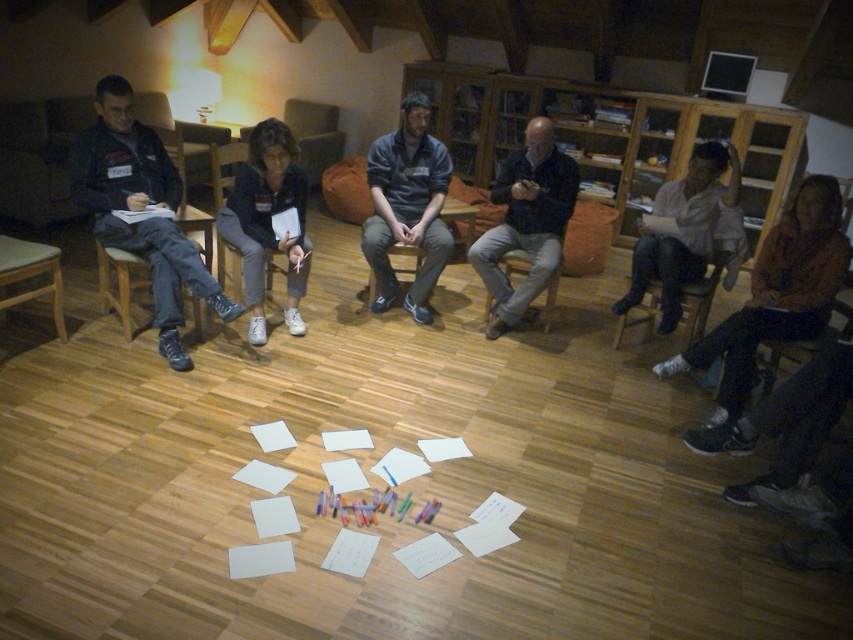
Which is more to the left, dark blue sweater at center or wooden chair at left?

From the viewer's perspective, wooden chair at left appears more on the left side.

Image resolution: width=853 pixels, height=640 pixels. In order to click on dark blue sweater at center in this screenshot , I will do 526,221.

Is dark blue shirt at center positioned in front of wooden chair at left?

No, it is not.

Can you confirm if dark blue shirt at center is bigger than wooden chair at left?

Yes, dark blue shirt at center is bigger than wooden chair at left.

Which is in front, point (369, 188) or point (103, 256)?

Point (103, 256) is in front.

Where is `dark blue shirt at center`? The width and height of the screenshot is (853, 640). dark blue shirt at center is located at coordinates (407, 208).

Can you confirm if dark blue sweater at center is shorter than white shirt at right?

In fact, dark blue sweater at center may be taller than white shirt at right.

Which is below, dark blue sweater at center or white shirt at right?

white shirt at right is below.

Find the location of a particular element. The width and height of the screenshot is (853, 640). dark blue sweater at center is located at coordinates (526, 221).